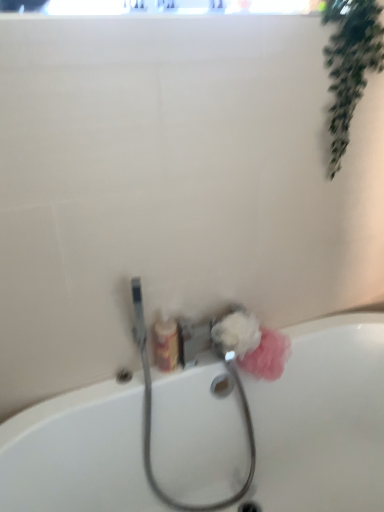
Question: Can you confirm if white fluffy sponge at lower center, which is counted as the 1th flower, starting from the left, is wider than pink fluffy sponge at lower right, arranged as the 2th flower when viewed from the left?

Choices:
 (A) yes
 (B) no

Answer: (A)

Question: Is white fluffy sponge at lower center, the second flower when ordered from right to left, looking in the opposite direction of pink fluffy sponge at lower right, arranged as the 2th flower when viewed from the left?

Choices:
 (A) yes
 (B) no

Answer: (B)

Question: Is white fluffy sponge at lower center, which is counted as the 1th flower, starting from the left, shorter than pink fluffy sponge at lower right, arranged as the 2th flower when viewed from the left?

Choices:
 (A) no
 (B) yes

Answer: (B)

Question: Can we say white fluffy sponge at lower center, which is counted as the 1th flower, starting from the left, lies outside pink fluffy sponge at lower right, arranged as the 2th flower when viewed from the left?

Choices:
 (A) no
 (B) yes

Answer: (B)

Question: Is there a large distance between white fluffy sponge at lower center, which is counted as the 1th flower, starting from the left, and pink fluffy sponge at lower right, arranged as the 2th flower when viewed from the left?

Choices:
 (A) yes
 (B) no

Answer: (B)

Question: From a real-world perspective, is white fluffy sponge at lower center, which is counted as the 1th flower, starting from the left, on pink fluffy sponge at lower right, arranged as the 2th flower when viewed from the left?

Choices:
 (A) no
 (B) yes

Answer: (B)

Question: From the image's perspective, would you say metallic silver garden hose at lower center is shown under white fluffy sponge at lower center, the second flower when ordered from right to left?

Choices:
 (A) yes
 (B) no

Answer: (A)

Question: Is metallic silver garden hose at lower center placed right next to white fluffy sponge at lower center, which is counted as the 1th flower, starting from the left?

Choices:
 (A) no
 (B) yes

Answer: (A)

Question: From a real-world perspective, is metallic silver garden hose at lower center positioned under white fluffy sponge at lower center, which is counted as the 1th flower, starting from the left, based on gravity?

Choices:
 (A) no
 (B) yes

Answer: (B)

Question: Is metallic silver garden hose at lower center at the left side of white fluffy sponge at lower center, which is counted as the 1th flower, starting from the left?

Choices:
 (A) no
 (B) yes

Answer: (B)

Question: Is metallic silver garden hose at lower center far from white fluffy sponge at lower center, the second flower when ordered from right to left?

Choices:
 (A) yes
 (B) no

Answer: (B)

Question: Considering the relative sizes of metallic silver garden hose at lower center and white fluffy sponge at lower center, the second flower when ordered from right to left, in the image provided, is metallic silver garden hose at lower center smaller than white fluffy sponge at lower center, the second flower when ordered from right to left,?

Choices:
 (A) no
 (B) yes

Answer: (A)

Question: From the image's perspective, is green leafy plant at upper right under white ceramic bathtub at lower center?

Choices:
 (A) no
 (B) yes

Answer: (A)